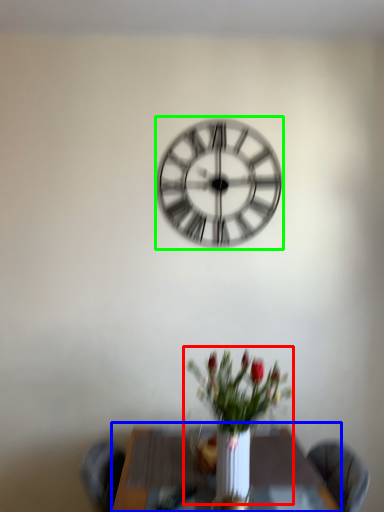
Question: Which is farther away from floral arrangement (highlighted by a red box)? table (highlighted by a blue box) or wall clock (highlighted by a green box)?

Choices:
 (A) table
 (B) wall clock

Answer: (B)